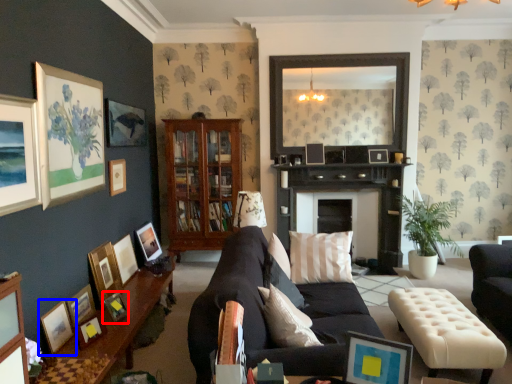
Question: Which point is closer to the camera, picture frame (highlighted by a red box) or picture frame (highlighted by a blue box)?

Choices:
 (A) picture frame
 (B) picture frame

Answer: (B)